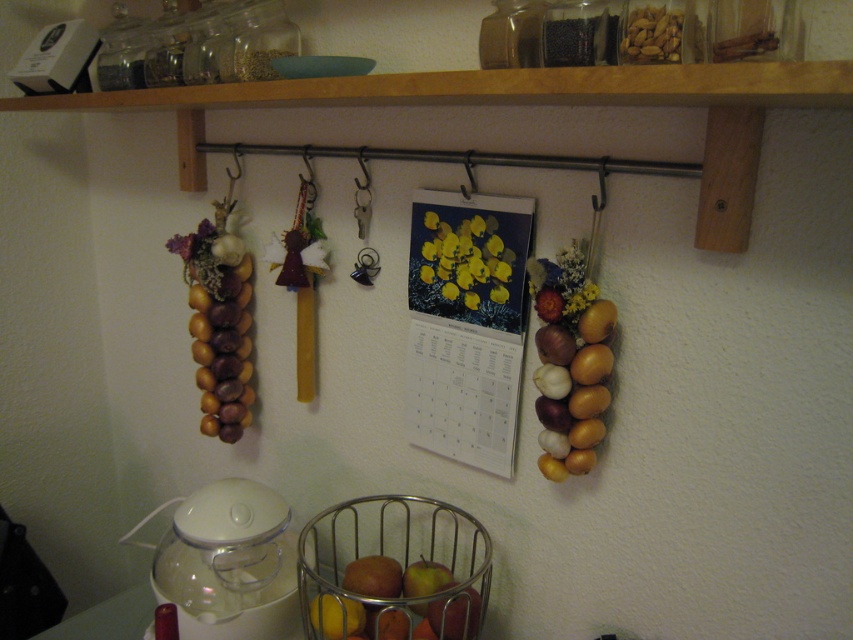
Is metallic wire basket at center taller than glossy apple at center?

Indeed, metallic wire basket at center has a greater height compared to glossy apple at center.

Who is positioned more to the right, metallic wire basket at center or glossy apple at center?

glossy apple at center is more to the right.

Describe the element at coordinates (393, 570) in the screenshot. The height and width of the screenshot is (640, 853). I see `metallic wire basket at center` at that location.

I want to click on metallic wire basket at center, so click(393, 570).

Based on the photo, can you confirm if glossy apple at center is bigger than matte brown onion at right?

Correct, glossy apple at center is larger in size than matte brown onion at right.

How distant is glossy apple at center from matte brown onion at right?

glossy apple at center is 13.44 inches away from matte brown onion at right.

Between point (434, 577) and point (541, 333), which one is positioned behind?

The point (434, 577) is more distant.

At what (x,y) coordinates should I click in order to perform the action: click on glossy apple at center. Please return your answer as a coordinate pair (x, y). Image resolution: width=853 pixels, height=640 pixels. Looking at the image, I should click on (425, 579).

Between point (381, 596) and point (566, 352), which one is positioned behind?

The point (381, 596) is behind.

Does matte brown apple at center have a lesser width compared to matte brown onion at right?

No, matte brown apple at center is not thinner than matte brown onion at right.

Is point (352, 564) less distant than point (572, 336)?

No, (352, 564) is further to viewer.

I want to click on matte brown apple at center, so click(x=373, y=577).